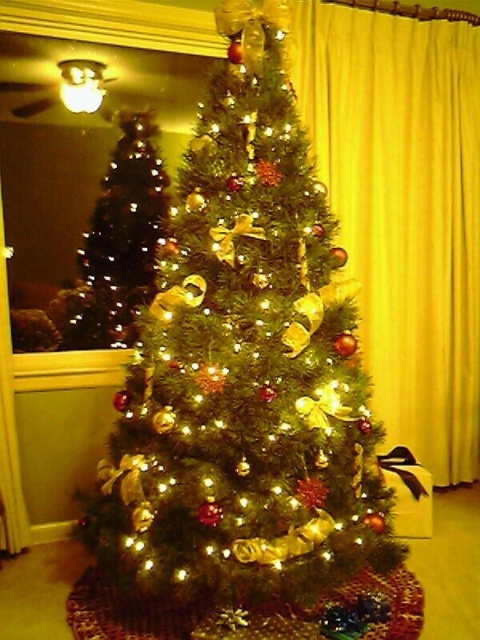
Consider the image. Which is above, green matte christmas tree at center or yellow velvet curtain at right?

Positioned higher is yellow velvet curtain at right.

Does green matte christmas tree at center have a greater height compared to yellow velvet curtain at right?

In fact, green matte christmas tree at center may be shorter than yellow velvet curtain at right.

The height and width of the screenshot is (640, 480). In order to click on green matte christmas tree at center in this screenshot , I will do `click(243, 371)`.

Does yellow velvet curtain at right lie behind matte gold christmas tree at left?

Yes, it is behind matte gold christmas tree at left.

Who is taller, yellow velvet curtain at right or matte gold christmas tree at left?

Standing taller between the two is yellow velvet curtain at right.

Between point (467, 467) and point (162, 209), which one is positioned behind?

The point (467, 467) is behind.

The height and width of the screenshot is (640, 480). In order to click on yellow velvet curtain at right in this screenshot , I will do `click(404, 209)`.

Is green matte christmas tree at center behind matte gold christmas tree at left?

No, green matte christmas tree at center is in front of matte gold christmas tree at left.

Is green matte christmas tree at center thinner than matte gold christmas tree at left?

No.

Is point (243, 445) closer to viewer compared to point (98, 234)?

Yes, point (243, 445) is closer to viewer.

You are a GUI agent. You are given a task and a screenshot of the screen. Output one action in this format:
    pyautogui.click(x=<x>, y=<y>)
    Task: Click on the green matte christmas tree at center
    This screenshot has width=480, height=640.
    Given the screenshot: What is the action you would take?
    point(243,371)